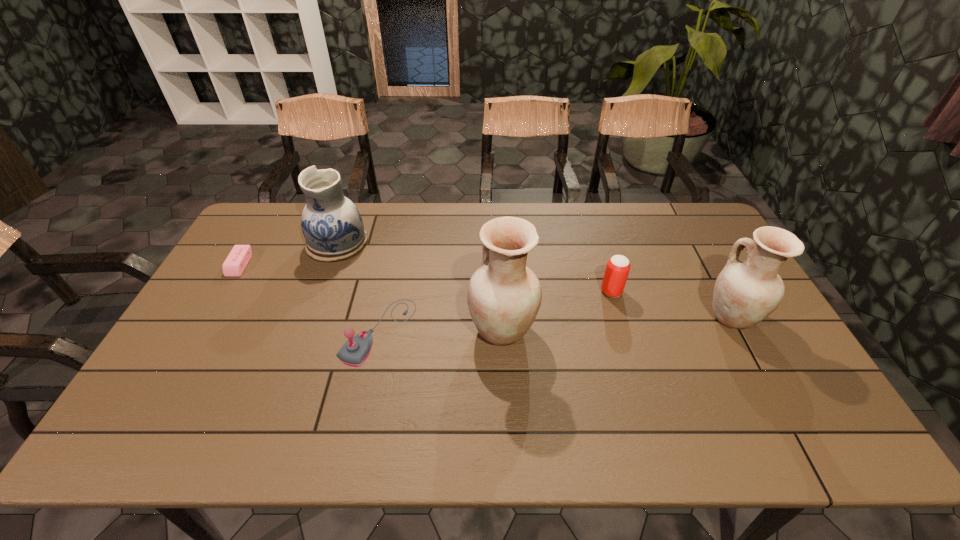
Find the location of a particular element. The image size is (960, 540). joystick is located at coordinates (354, 352).

At what (x,y) coordinates should I click in order to perform the action: click on free location located on the left of the second pottery from left to right. Please return your answer as a coordinate pair (x, y). This screenshot has height=540, width=960. Looking at the image, I should click on (421, 329).

Identify the location of vacant area located 0.390m on the left of the rightmost object. This screenshot has width=960, height=540. (567, 317).

I want to click on free space located on the back of the fifth object from right to left, so coord(348,215).

Locate an element on the screen. This screenshot has width=960, height=540. vacant area situated 0.060m on the front of the leftmost object is located at coordinates (225, 291).

Where is `vacant space positioned on the front of the third shortest object`? Image resolution: width=960 pixels, height=540 pixels. vacant space positioned on the front of the third shortest object is located at coordinates (628, 349).

Find the location of a particular element. free space located 0.200m on the right of the joystick is located at coordinates (485, 332).

Where is `object situated at the far edge`? The width and height of the screenshot is (960, 540). object situated at the far edge is located at coordinates click(x=332, y=225).

The height and width of the screenshot is (540, 960). Find the location of `object present at the left edge`. object present at the left edge is located at coordinates (234, 265).

At what (x,y) coordinates should I click in order to perform the action: click on object situated at the right edge. Please return your answer as a coordinate pair (x, y). This screenshot has width=960, height=540. Looking at the image, I should click on (746, 292).